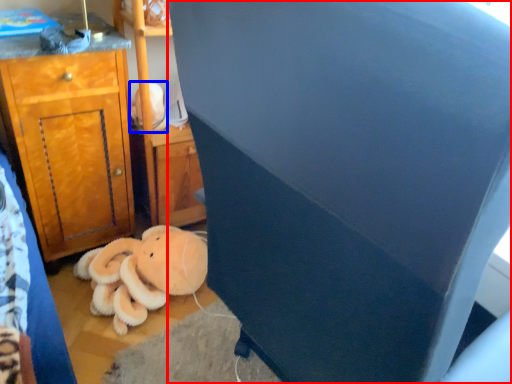
Question: Among these objects, which one is nearest to the camera, furniture (highlighted by a red box) or toy (highlighted by a blue box)?

Choices:
 (A) furniture
 (B) toy

Answer: (A)